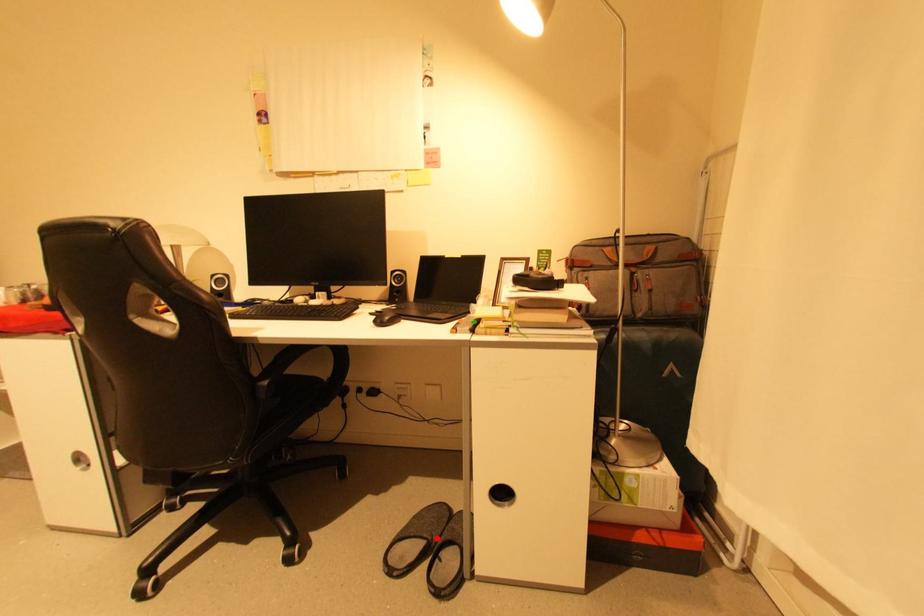
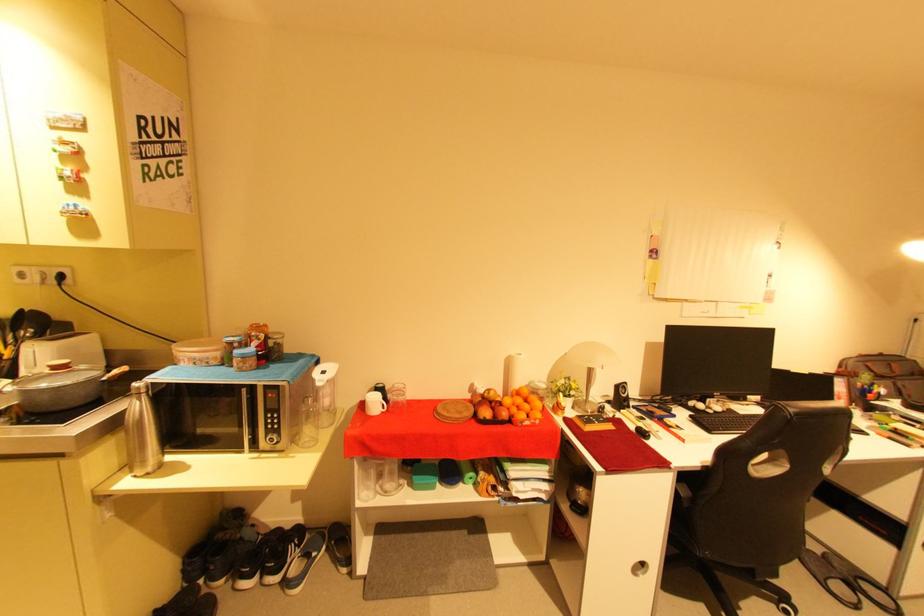
Find the pixel in the second image that matches the highlighted location in the first image.

(847, 578)